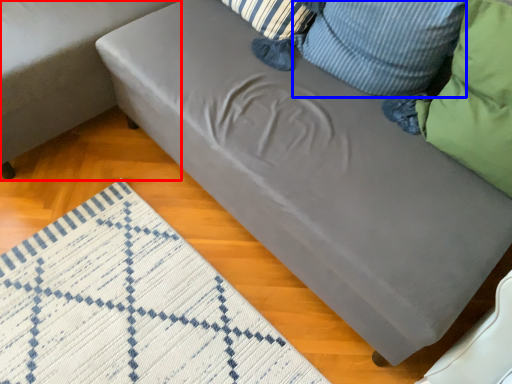
Question: Which object appears farthest to the camera in this image, studio couch (highlighted by a red box) or pillow (highlighted by a blue box)?

Choices:
 (A) studio couch
 (B) pillow

Answer: (A)